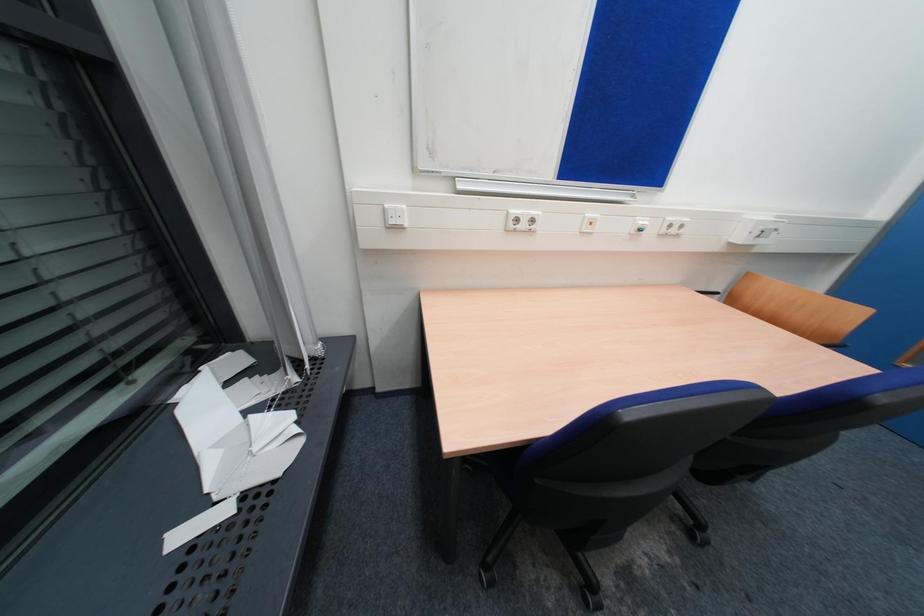
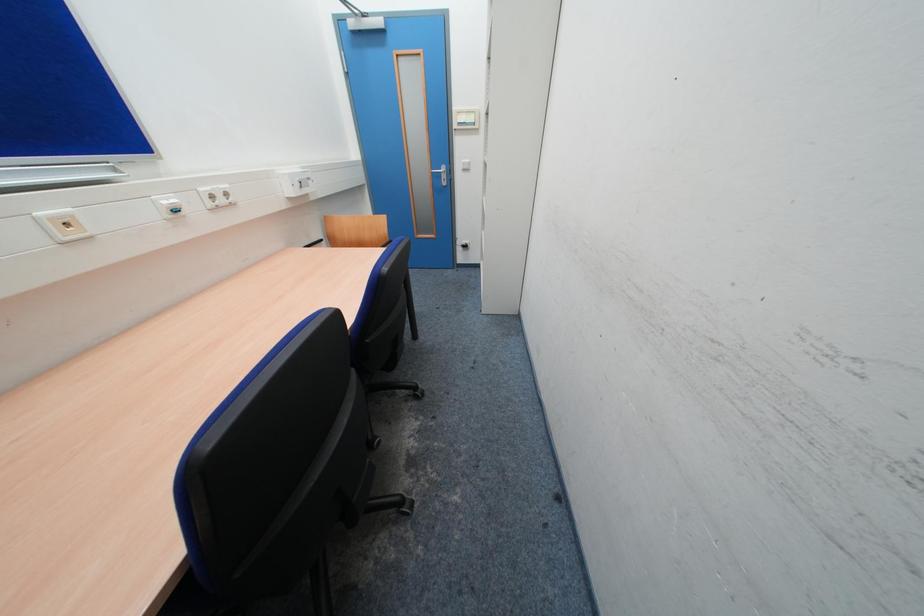
The images are taken continuously from a first-person perspective. In which direction is your viewpoint rotating?

The camera rotated toward right-down.